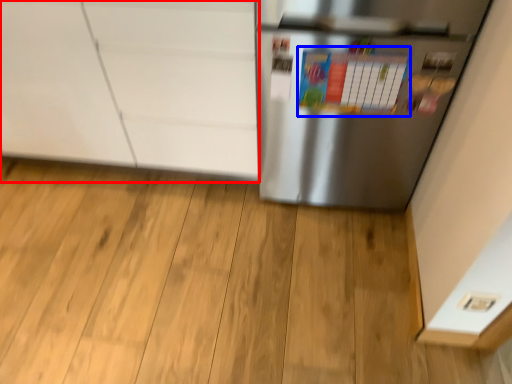
Question: Which object appears closest to the camera in this image, cabinetry (highlighted by a red box) or bulletin board (highlighted by a blue box)?

Choices:
 (A) cabinetry
 (B) bulletin board

Answer: (B)